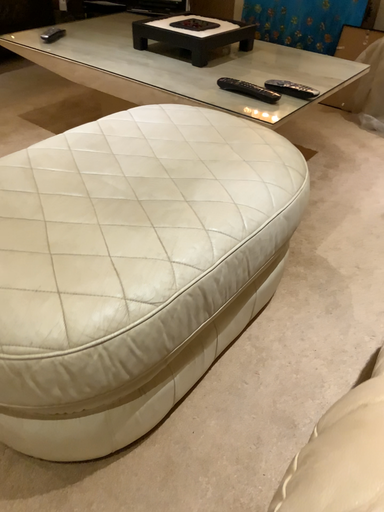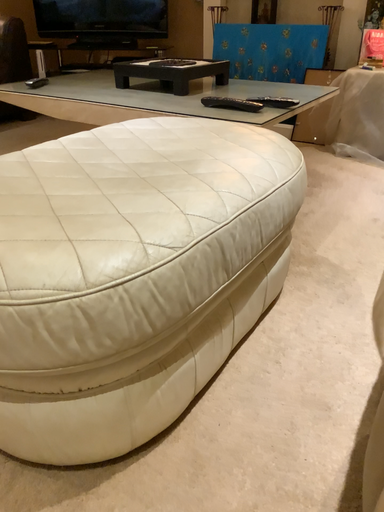
Question: Which way did the camera rotate in the video?

Choices:
 (A) rotated upward
 (B) rotated downward

Answer: (A)